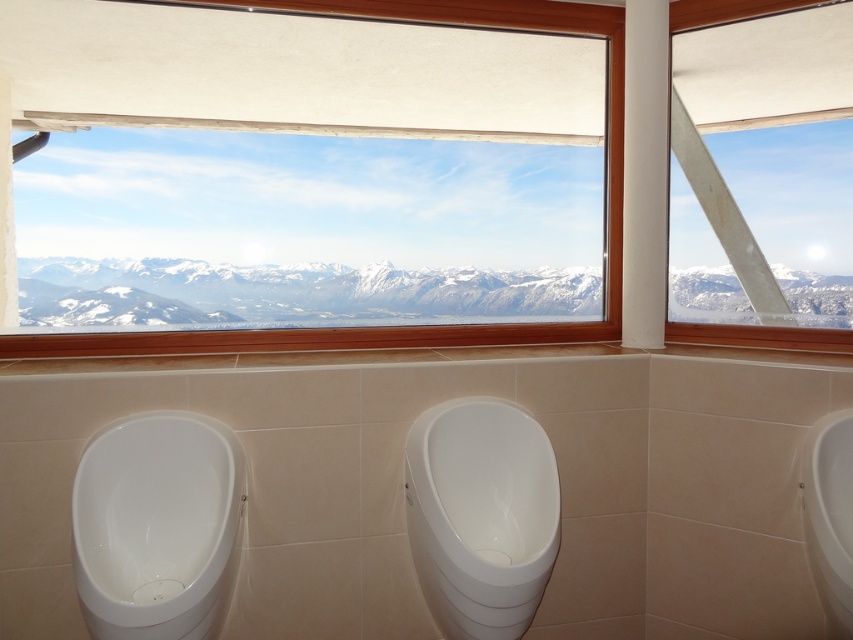
Does snowy mountain range at upper center have a greater width compared to wooden frame at upper center?

Yes.

At what (x,y) coordinates should I click in order to perform the action: click on snowy mountain range at upper center. Please return your answer as a coordinate pair (x, y). Image resolution: width=853 pixels, height=640 pixels. Looking at the image, I should click on (289, 292).

You are a GUI agent. You are given a task and a screenshot of the screen. Output one action in this format:
    pyautogui.click(x=<x>, y=<y>)
    Task: Click on the snowy mountain range at upper center
    This screenshot has height=640, width=853.
    Given the screenshot: What is the action you would take?
    (x=289, y=292)

Does point (84, 611) come behind point (585, 26)?

No, (84, 611) is in front of (585, 26).

Where is `white glossy urinal at left`? This screenshot has width=853, height=640. white glossy urinal at left is located at coordinates (157, 525).

Who is more distant from viewer, [241,502] or [7,355]?

The point [7,355] is more distant.

The height and width of the screenshot is (640, 853). Identify the location of white glossy urinal at left. (157, 525).

Which is more to the left, white glossy urinal at left or white glossy urinal at center?

From the viewer's perspective, white glossy urinal at left appears more on the left side.

What do you see at coordinates (157, 525) in the screenshot? This screenshot has height=640, width=853. I see `white glossy urinal at left` at bounding box center [157, 525].

Locate an element on the screen. white glossy urinal at left is located at coordinates (157, 525).